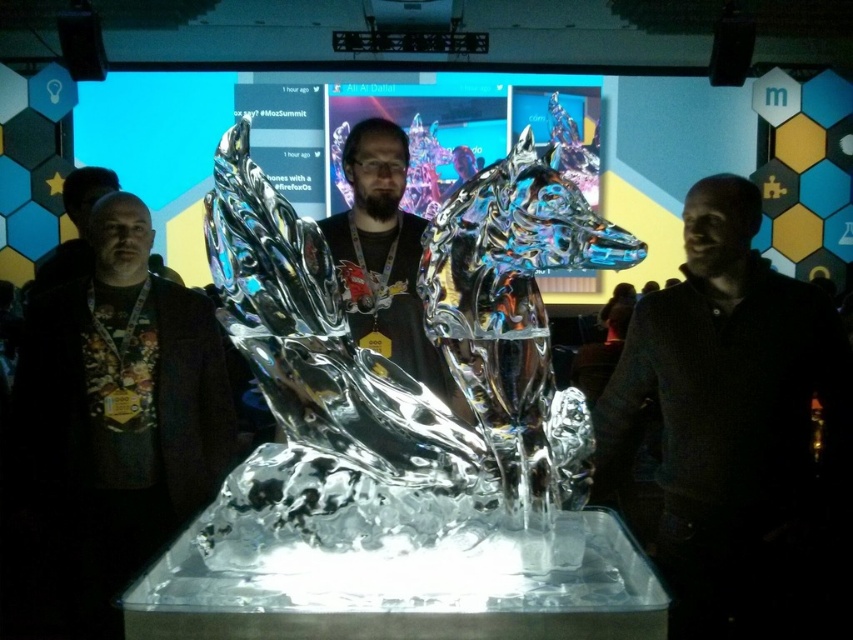
Can you confirm if clear glass horse at center is positioned below dark gray sweater at right?

Actually, clear glass horse at center is above dark gray sweater at right.

What do you see at coordinates (402, 371) in the screenshot? I see `clear glass horse at center` at bounding box center [402, 371].

Identify the location of clear glass horse at center. (402, 371).

Which is more to the right, dark gray sweater at right or dark brown leather jacket at center?

From the viewer's perspective, dark gray sweater at right appears more on the right side.

Does dark gray sweater at right have a greater height compared to dark brown leather jacket at center?

Indeed, dark gray sweater at right has a greater height compared to dark brown leather jacket at center.

Between point (850, 436) and point (103, 280), which one is positioned in front?

Positioned in front is point (103, 280).

You are a GUI agent. You are given a task and a screenshot of the screen. Output one action in this format:
    pyautogui.click(x=<x>, y=<y>)
    Task: Click on the dark gray sweater at right
    The width and height of the screenshot is (853, 640).
    Given the screenshot: What is the action you would take?
    pyautogui.click(x=738, y=429)

Is clear glass horse at center to the right of dark brown leather jacket at center from the viewer's perspective?

Indeed, clear glass horse at center is positioned on the right side of dark brown leather jacket at center.

Who is more forward, (213, 260) or (48, 429)?

Point (213, 260) is in front.

The height and width of the screenshot is (640, 853). Describe the element at coordinates (402, 371) in the screenshot. I see `clear glass horse at center` at that location.

This screenshot has height=640, width=853. Identify the location of clear glass horse at center. (402, 371).